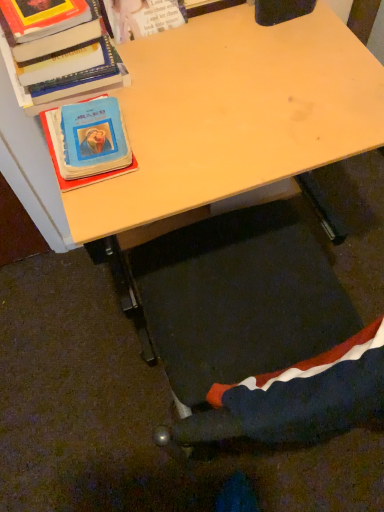
The width and height of the screenshot is (384, 512). Find the location of `free spot to the right of hardcover book at upper left, arranged as the first book when viewed from the top`. free spot to the right of hardcover book at upper left, arranged as the first book when viewed from the top is located at coordinates (175, 70).